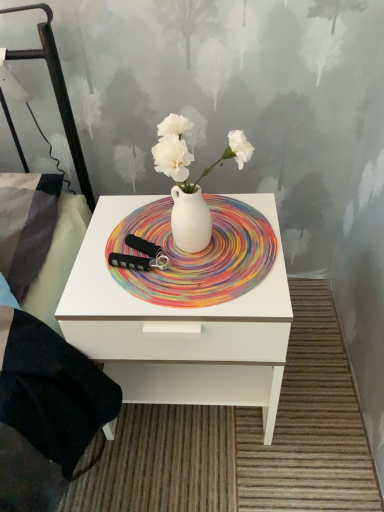
What do you see at coordinates (179, 328) in the screenshot? The image size is (384, 512). I see `white glossy nightstand at center` at bounding box center [179, 328].

Locate an element on the screen. The image size is (384, 512). white matte plate at center is located at coordinates (197, 255).

Locate an element on the screen. This screenshot has width=384, height=512. white glossy nightstand at center is located at coordinates (179, 328).

From the image's perspective, relative to white glossy nightstand at center, is white matte plate at center above or below?

Clearly, from the image's perspective, white matte plate at center is above white glossy nightstand at center.

Would you say white matte plate at center contains white glossy nightstand at center?

No, white glossy nightstand at center is not a part of white matte plate at center.

Based on the photo, could you tell me if white matte plate at center is turned towards white glossy nightstand at center?

Yes.

How many degrees apart are the facing directions of white matte plate at center and white glossy nightstand at center?

There is a 0.00016-degree angle between the facing directions of white matte plate at center and white glossy nightstand at center.

Is white matte plate at center inside or outside of white matte vase at center?

white matte plate at center is not enclosed by white matte vase at center.

Does white matte plate at center have a smaller size compared to white matte vase at center?

Correct, white matte plate at center occupies less space than white matte vase at center.

From the image's perspective, which object appears higher, white matte plate at center or white matte vase at center?

From the image's view, white matte vase at center is above.

Between white matte vase at center and white matte plate at center, which one appears on the right side from the viewer's perspective?

From the viewer's perspective, white matte vase at center appears more on the right side.

Are white matte vase at center and white matte plate at center located far from each other?

No, white matte vase at center is not far away from white matte plate at center.

Find the location of a particular element. The image size is (384, 512). plate located on the left of white matte vase at center is located at coordinates (197, 255).

Is white glossy nightstand at center aimed at white matte plate at center?

No, white glossy nightstand at center does not turn towards white matte plate at center.

Is white glossy nightstand at center not close to white matte plate at center?

Actually, white glossy nightstand at center and white matte plate at center are a little close together.

From a real-world perspective, which is physically above, white glossy nightstand at center or white matte plate at center?

In real-world perspective, white matte plate at center is above.

From a real-world perspective, does white matte vase at center stand above white glossy nightstand at center?

Yes, from a real-world perspective, white matte vase at center is over white glossy nightstand at center

Does point (201, 248) lie in front of point (105, 297)?

That is False.

Measure the distance between white matte vase at center and white glossy nightstand at center.

They are 10.17 inches apart.

Considering the positions of objects white glossy nightstand at center and white matte vase at center in the image provided, who is more to the right, white glossy nightstand at center or white matte vase at center?

white matte vase at center is more to the right.

Considering the points (66, 338) and (157, 151), which point is in front, point (66, 338) or point (157, 151)?

Point (157, 151)

Locate an element on the screen. nightstand to the left of white matte vase at center is located at coordinates (179, 328).

Which object is further away from the camera taking this photo, white glossy nightstand at center or white matte vase at center?

Positioned behind is white glossy nightstand at center.

Find the location of a particular element. plate on the right of white glossy nightstand at center is located at coordinates (197, 255).

At what (x,y) coordinates should I click in order to perform the action: click on floral arrangement above the white matte plate at center (from the image's perspective). Please return your answer as a coordinate pair (x, y). This screenshot has width=384, height=512. Looking at the image, I should click on (191, 183).

Estimate the real-world distances between objects in this image. Which object is further from white matte plate at center, white matte vase at center or white glossy nightstand at center?

Among the two, white glossy nightstand at center is located further to white matte plate at center.

From the image, which object appears to be nearer to white matte vase at center, white glossy nightstand at center or white matte plate at center?

The object closer to white matte vase at center is white matte plate at center.

Estimate the real-world distances between objects in this image. Which object is closer to white glossy nightstand at center, white matte plate at center or white matte vase at center?

white matte plate at center lies closer to white glossy nightstand at center than the other object.

Considering their positions, is white matte vase at center positioned closer to white glossy nightstand at center than white matte plate at center?

white matte plate at center is positioned closer to the anchor white glossy nightstand at center.

Which object lies nearer to the anchor point white matte vase at center, white matte plate at center or white glossy nightstand at center?

Based on the image, white matte plate at center appears to be nearer to white matte vase at center.

Based on their spatial positions, is white glossy nightstand at center or white matte vase at center closer to white matte plate at center?

The object closer to white matte plate at center is white matte vase at center.

This screenshot has width=384, height=512. I want to click on plate between white matte vase at center and white glossy nightstand at center in the up-down direction, so click(x=197, y=255).